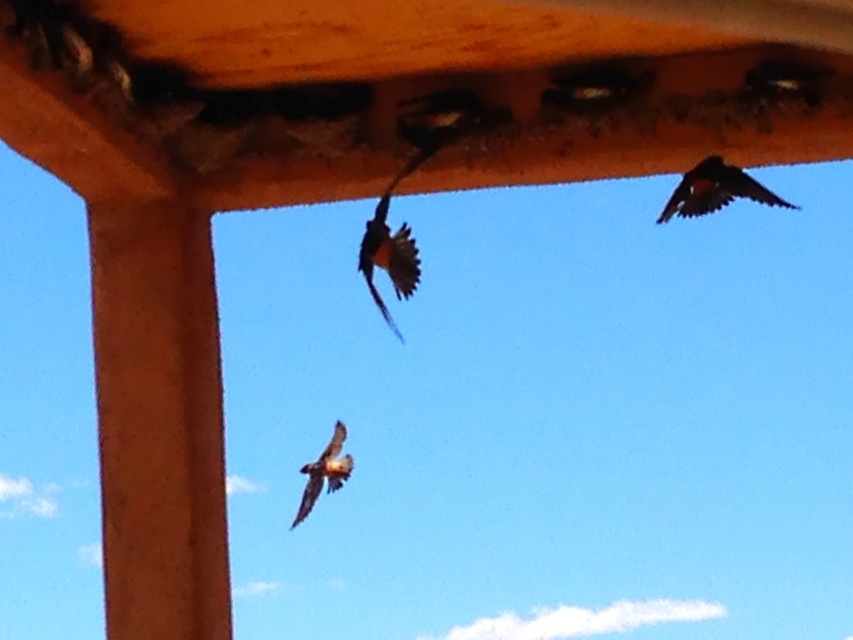
Question: Among these points, which one is farthest from the camera?

Choices:
 (A) (369, 273)
 (B) (793, 208)

Answer: (A)

Question: Among these points, which one is nearest to the camera?

Choices:
 (A) (305, 486)
 (B) (724, 204)

Answer: (A)

Question: Is orange-brown feathers at center in front of brown feathered bird at upper right?

Choices:
 (A) no
 (B) yes

Answer: (A)

Question: Is brown feathered bird at upper right smaller than brown feathered bird at center?

Choices:
 (A) no
 (B) yes

Answer: (A)

Question: Can you confirm if orange-brown feathers at center is positioned above brown feathered bird at center?

Choices:
 (A) no
 (B) yes

Answer: (B)

Question: Which point appears closest to the camera in this image?

Choices:
 (A) (746, 188)
 (B) (378, 252)

Answer: (A)